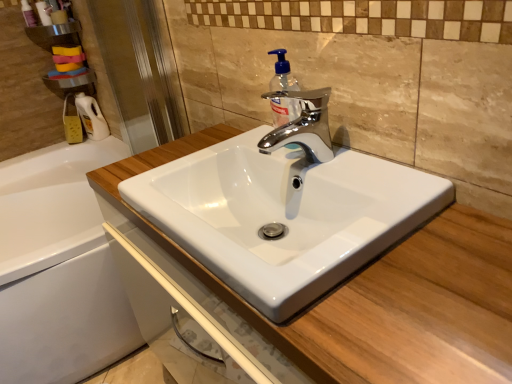
Question: Considering the relative positions of transparent plastic screen door at left and white plastic bottle at left in the image provided, is transparent plastic screen door at left behind white plastic bottle at left?

Choices:
 (A) no
 (B) yes

Answer: (A)

Question: Does transparent plastic screen door at left have a smaller size compared to white plastic bottle at left?

Choices:
 (A) yes
 (B) no

Answer: (B)

Question: Can you confirm if transparent plastic screen door at left is thinner than white plastic bottle at left?

Choices:
 (A) yes
 (B) no

Answer: (A)

Question: Does transparent plastic screen door at left turn towards white plastic bottle at left?

Choices:
 (A) yes
 (B) no

Answer: (B)

Question: Is transparent plastic screen door at left next to white plastic bottle at left and touching it?

Choices:
 (A) no
 (B) yes

Answer: (A)

Question: Is transparent plastic screen door at left far from white plastic bottle at left?

Choices:
 (A) no
 (B) yes

Answer: (A)

Question: Is matte white lotion at upper left completely or partially outside of transparent plastic soap dispenser at center?

Choices:
 (A) no
 (B) yes

Answer: (B)

Question: From the image's perspective, is matte white lotion at upper left below transparent plastic soap dispenser at center?

Choices:
 (A) yes
 (B) no

Answer: (B)

Question: From a real-world perspective, is matte white lotion at upper left under transparent plastic soap dispenser at center?

Choices:
 (A) yes
 (B) no

Answer: (B)

Question: From a real-world perspective, is matte white lotion at upper left on transparent plastic soap dispenser at center?

Choices:
 (A) no
 (B) yes

Answer: (B)

Question: Does matte white lotion at upper left come behind transparent plastic soap dispenser at center?

Choices:
 (A) no
 (B) yes

Answer: (B)

Question: Is the depth of matte white lotion at upper left less than that of transparent plastic soap dispenser at center?

Choices:
 (A) yes
 (B) no

Answer: (B)

Question: Does transparent plastic screen door at left have a greater height compared to metallic silver shelf at upper left?

Choices:
 (A) yes
 (B) no

Answer: (A)